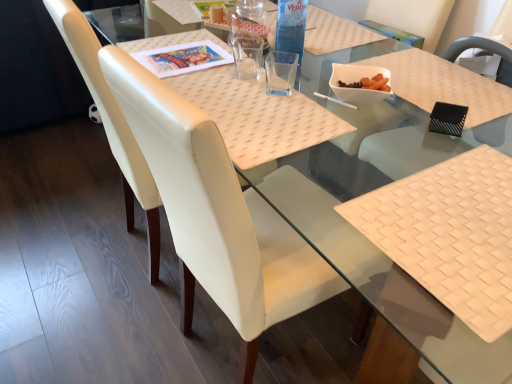
Locate an element on the screen. vacant space that is to the left of white leather chair at left, which is the 3th chair in right-to-left order is located at coordinates (68, 236).